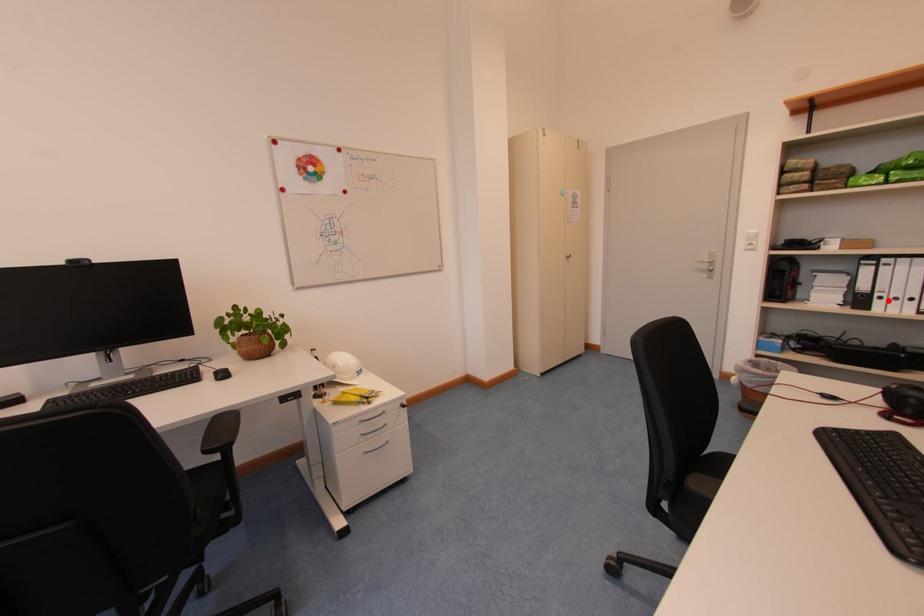
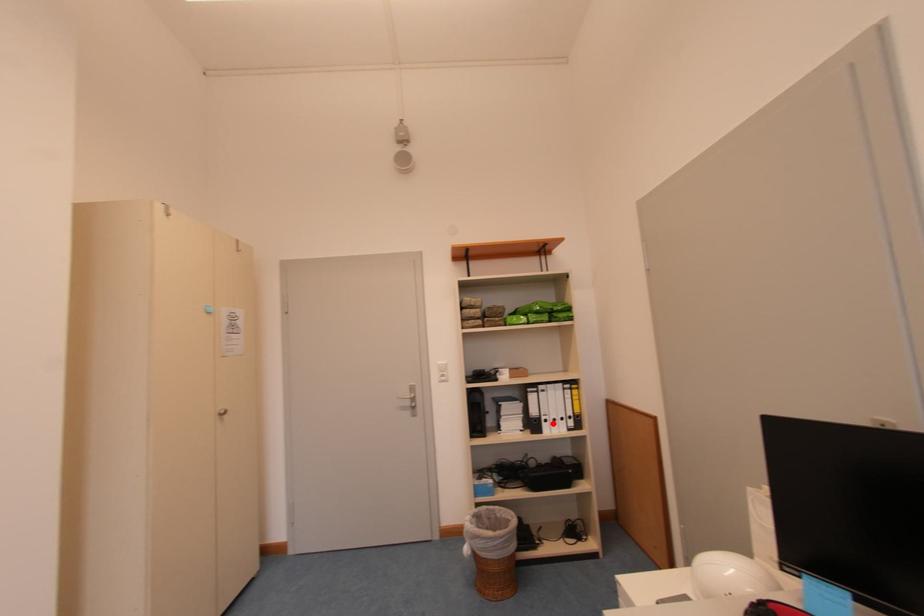
I am providing you with two images of the same scene from different viewpoints. A red point is marked on the first image and another point is marked on the second image. Is the marked point in image1 the same physical position as the marked point in image2?

Yes